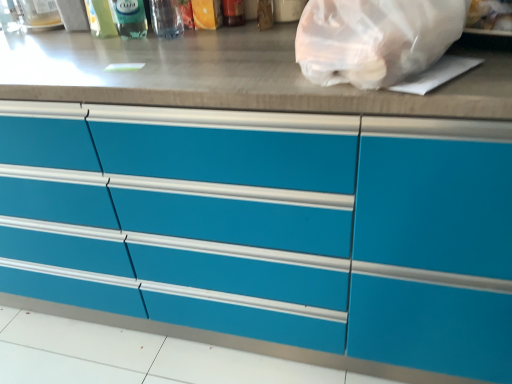
Question: Is transparent plastic bottle at upper center, placed as the third bottle when sorted from left to right, located outside transparent plastic bottle at upper left, which is the second bottle in right-to-left order?

Choices:
 (A) yes
 (B) no

Answer: (A)

Question: Considering the relative positions of transparent plastic bottle at upper center, marked as the 1th bottle in a right-to-left arrangement, and transparent plastic bottle at upper left, which is the second bottle in right-to-left order, in the image provided, is transparent plastic bottle at upper center, marked as the 1th bottle in a right-to-left arrangement, to the left of transparent plastic bottle at upper left, which is the second bottle in right-to-left order, from the viewer's perspective?

Choices:
 (A) yes
 (B) no

Answer: (B)

Question: From the image's perspective, is transparent plastic bottle at upper center, marked as the 1th bottle in a right-to-left arrangement, below transparent plastic bottle at upper left, which is the 2th bottle in left-to-right order?

Choices:
 (A) no
 (B) yes

Answer: (B)

Question: Does transparent plastic bottle at upper center, placed as the third bottle when sorted from left to right, touch transparent plastic bottle at upper left, which is the second bottle in right-to-left order?

Choices:
 (A) yes
 (B) no

Answer: (A)

Question: From a real-world perspective, is transparent plastic bottle at upper center, placed as the third bottle when sorted from left to right, below transparent plastic bottle at upper left, which is the 2th bottle in left-to-right order?

Choices:
 (A) yes
 (B) no

Answer: (B)

Question: Is transparent plastic bottle at upper center, marked as the 1th bottle in a right-to-left arrangement, positioned in front of transparent plastic bottle at upper left, which is the 2th bottle in left-to-right order?

Choices:
 (A) no
 (B) yes

Answer: (B)

Question: Are transparent plastic bottle at upper center, placed as the third bottle when sorted from left to right, and matte blue drawers at center beside each other?

Choices:
 (A) yes
 (B) no

Answer: (B)

Question: Is transparent plastic bottle at upper center, placed as the third bottle when sorted from left to right, thinner than matte blue drawers at center?

Choices:
 (A) yes
 (B) no

Answer: (A)

Question: Does transparent plastic bottle at upper center, placed as the third bottle when sorted from left to right, contain matte blue drawers at center?

Choices:
 (A) no
 (B) yes

Answer: (A)

Question: Can you confirm if transparent plastic bottle at upper center, placed as the third bottle when sorted from left to right, is taller than matte blue drawers at center?

Choices:
 (A) yes
 (B) no

Answer: (B)

Question: Can you confirm if transparent plastic bottle at upper center, placed as the third bottle when sorted from left to right, is positioned to the left of matte blue drawers at center?

Choices:
 (A) no
 (B) yes

Answer: (A)

Question: Is transparent plastic bottle at upper center, marked as the 1th bottle in a right-to-left arrangement, positioned behind matte blue drawers at center?

Choices:
 (A) no
 (B) yes

Answer: (B)

Question: Does transparent plastic bottle at upper left, which is the second bottle in right-to-left order, have a greater height compared to translucent plastic bottle at upper center, which appears as the third bottle when viewed from the right?

Choices:
 (A) no
 (B) yes

Answer: (A)